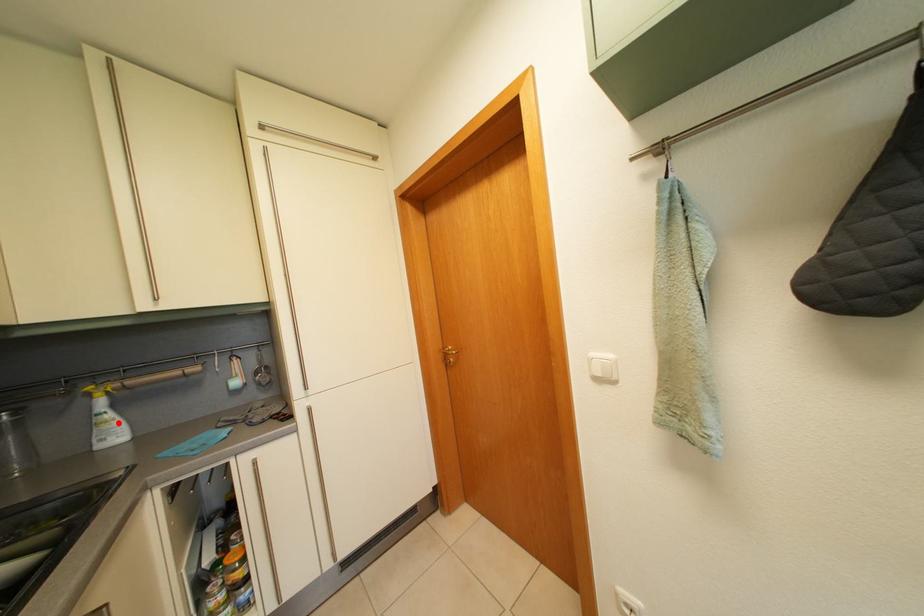
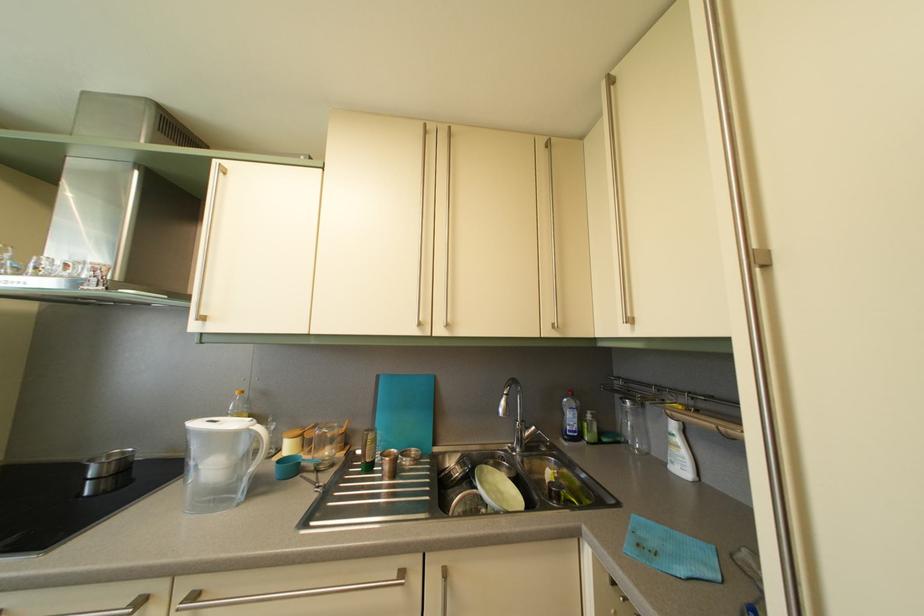
Where in the second image is the point corresponding to the highlighted location from the first image?

(687, 448)